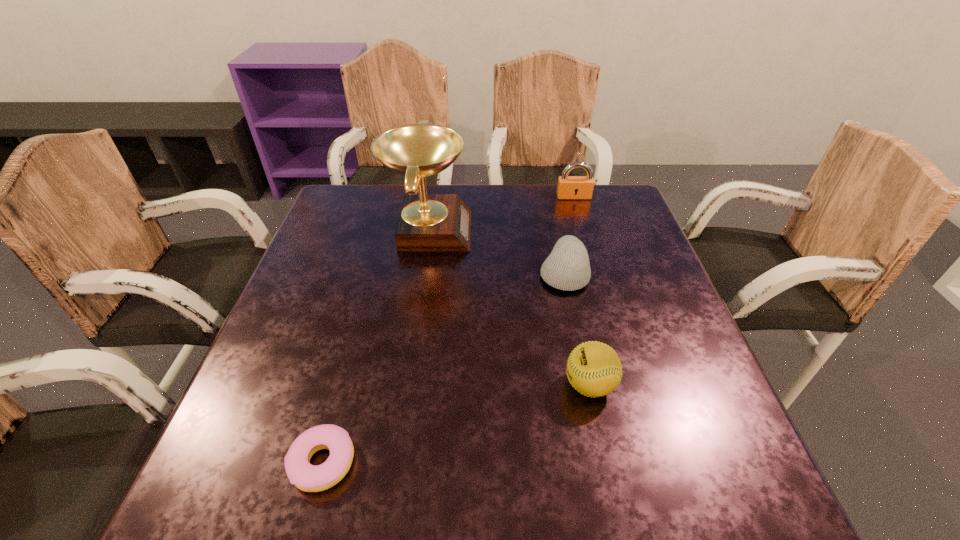
Find the location of a particular element. This screenshot has height=540, width=960. blank area in the image that satisfies the following two spatial constraints: 1. on the logo side of the second nearest object; 2. on the front side of the doughnut is located at coordinates (607, 462).

The image size is (960, 540). I want to click on free region that satisfies the following two spatial constraints: 1. on the back side of the beanie; 2. on the right side of the doughnut, so click(373, 273).

Where is `free point that satisfies the following two spatial constraints: 1. on the front-facing side of the award; 2. on the front side of the doughnut`? The width and height of the screenshot is (960, 540). free point that satisfies the following two spatial constraints: 1. on the front-facing side of the award; 2. on the front side of the doughnut is located at coordinates (394, 462).

The width and height of the screenshot is (960, 540). I want to click on vacant position in the image that satisfies the following two spatial constraints: 1. on the front-facing side of the beanie; 2. on the right side of the award, so click(x=421, y=273).

Where is `vacant space that satisfies the following two spatial constraints: 1. to unlock the second tallest object from the front; 2. on the logo side of the softball`? The image size is (960, 540). vacant space that satisfies the following two spatial constraints: 1. to unlock the second tallest object from the front; 2. on the logo side of the softball is located at coordinates (629, 385).

At what (x,y) coordinates should I click in order to perform the action: click on vacant area in the image that satisfies the following two spatial constraints: 1. to unlock the second tallest object from the front; 2. on the front-facing side of the award. Please return your answer as a coordinate pair (x, y). The width and height of the screenshot is (960, 540). Looking at the image, I should click on (584, 230).

At what (x,y) coordinates should I click in order to perform the action: click on free location that satisfies the following two spatial constraints: 1. on the front-facing side of the beanie; 2. on the left side of the award. Please return your answer as a coordinate pair (x, y). Looking at the image, I should click on (421, 273).

What are the coordinates of `free space that satisfies the following two spatial constraints: 1. to unlock the padlock from the front; 2. on the front-facing side of the award` in the screenshot? It's located at (584, 230).